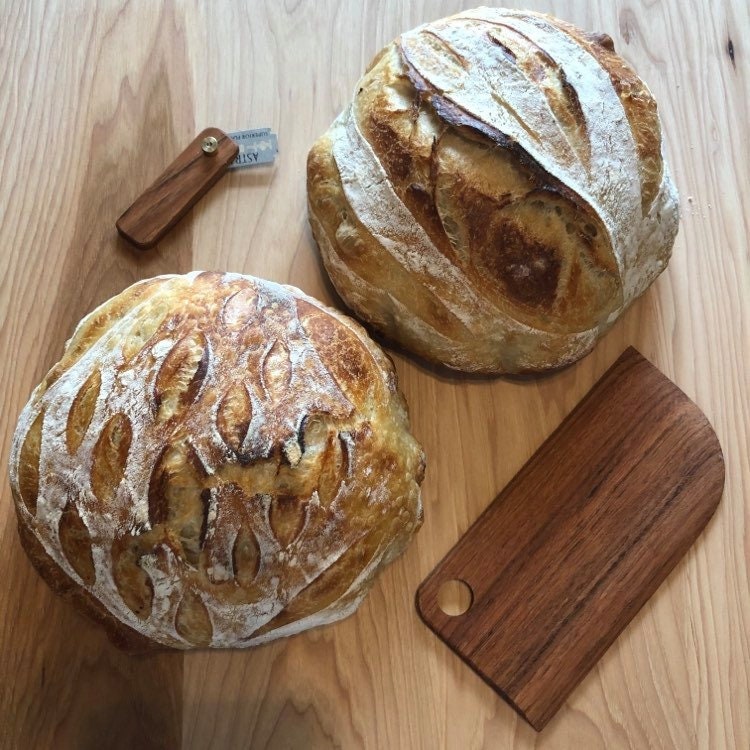
This screenshot has width=750, height=750. I want to click on table, so click(691, 309).